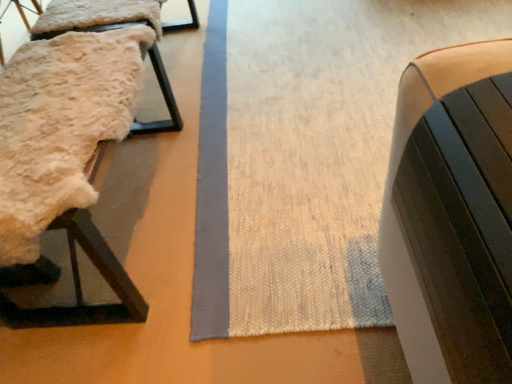
Question: Should I look upward or downward to see fuzzy sheepskin at left, which is counted as the second furniture, starting from the left?

Choices:
 (A) down
 (B) up

Answer: (B)

Question: Can you confirm if matte black bench at right, which ranks as the 3th furniture in back-to-front order, is positioned to the right of fuzzy sheepskin at left, which is counted as the second furniture, starting from the left?

Choices:
 (A) yes
 (B) no

Answer: (A)

Question: Is matte black bench at right, the 1th furniture in the right-to-left sequence, oriented towards fuzzy sheepskin at left, which is counted as the second furniture, starting from the left?

Choices:
 (A) yes
 (B) no

Answer: (B)

Question: Does matte black bench at right, the 1th furniture in the right-to-left sequence, have a lesser height compared to fuzzy sheepskin at left, acting as the 1th furniture starting from the back?

Choices:
 (A) no
 (B) yes

Answer: (B)

Question: Are matte black bench at right, the first furniture from the front, and fuzzy sheepskin at left, marked as the second furniture in a right-to-left arrangement, far apart?

Choices:
 (A) yes
 (B) no

Answer: (A)

Question: Is fuzzy sheepskin at left, marked as the second furniture in a right-to-left arrangement, inside matte black bench at right, which ranks as the 3th furniture in back-to-front order?

Choices:
 (A) yes
 (B) no

Answer: (B)

Question: Is matte black bench at right, the first furniture from the front, in front of fuzzy sheepskin at left, acting as the 1th furniture starting from the back?

Choices:
 (A) no
 (B) yes

Answer: (B)

Question: Can fuzzy sheepskin at left, marked as the 3th furniture in a front-to-back arrangement, be found inside fluffy sheepskin at left, marked as the second furniture in a back-to-front arrangement?

Choices:
 (A) no
 (B) yes

Answer: (A)

Question: Considering the relative positions of fluffy sheepskin at left, acting as the 3th furniture starting from the right, and fuzzy sheepskin at left, acting as the 1th furniture starting from the back, in the image provided, is fluffy sheepskin at left, acting as the 3th furniture starting from the right, to the right of fuzzy sheepskin at left, acting as the 1th furniture starting from the back, from the viewer's perspective?

Choices:
 (A) yes
 (B) no

Answer: (B)

Question: Can you confirm if fluffy sheepskin at left, marked as the second furniture in a front-to-back arrangement, is taller than fuzzy sheepskin at left, which is counted as the second furniture, starting from the left?

Choices:
 (A) yes
 (B) no

Answer: (B)

Question: Is fuzzy sheepskin at left, acting as the 1th furniture starting from the back, at the back of fluffy sheepskin at left, marked as the second furniture in a front-to-back arrangement?

Choices:
 (A) yes
 (B) no

Answer: (B)

Question: Is fluffy sheepskin at left, marked as the second furniture in a front-to-back arrangement, bigger than fuzzy sheepskin at left, marked as the 3th furniture in a front-to-back arrangement?

Choices:
 (A) no
 (B) yes

Answer: (A)

Question: Is fluffy sheepskin at left, marked as the second furniture in a back-to-front arrangement, turned away from matte black bench at right, the first furniture from the front?

Choices:
 (A) no
 (B) yes

Answer: (A)